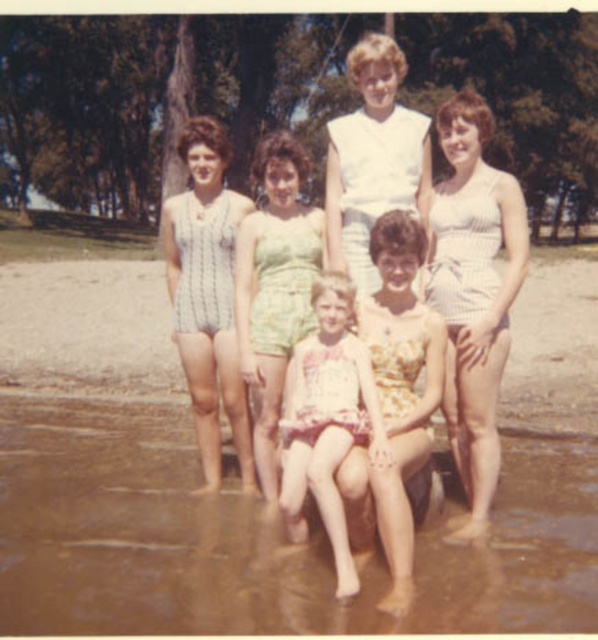
Who is more forward, (x=425, y=269) or (x=340, y=365)?

Point (x=340, y=365)

In the scene shown: Between striped fabric swimsuit at center and printed cotton dress at center, which one has less height?

printed cotton dress at center

Is point (395, 257) closer to viewer compared to point (327, 513)?

That is False.

You are a GUI agent. You are given a task and a screenshot of the screen. Output one action in this format:
    pyautogui.click(x=<x>, y=<y>)
    Task: Click on the striped fabric swimsuit at center
    The width and height of the screenshot is (598, 640).
    Given the screenshot: What is the action you would take?
    pos(435,324)

Where is `yellow floral dress at center`? This screenshot has width=598, height=640. yellow floral dress at center is located at coordinates (395, 396).

Image resolution: width=598 pixels, height=640 pixels. What do you see at coordinates (395, 396) in the screenshot? I see `yellow floral dress at center` at bounding box center [395, 396].

Locate an element on the screen. yellow floral dress at center is located at coordinates (395, 396).

Describe the element at coordinates (274, 289) in the screenshot. This screenshot has width=598, height=640. I see `green floral swimsuit at center` at that location.

Is green floral swimsuit at center thinner than printed cotton dress at center?

In fact, green floral swimsuit at center might be wider than printed cotton dress at center.

Is point (249, 346) in front of point (358, 337)?

No, it is behind (358, 337).

Where is `green floral swimsuit at center`? This screenshot has width=598, height=640. green floral swimsuit at center is located at coordinates (x=274, y=289).